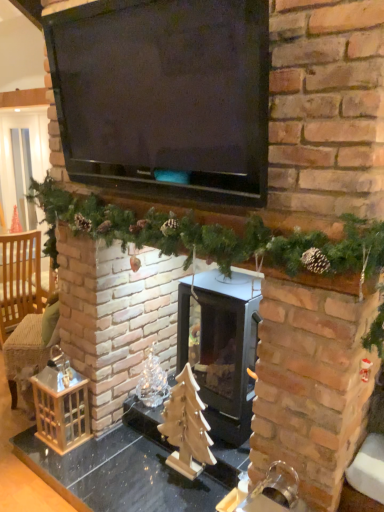
Locate an element on the screen. The height and width of the screenshot is (512, 384). wooden table at center is located at coordinates (131, 468).

Describe the element at coordinates (221, 347) in the screenshot. I see `black glass wood burning stove at center` at that location.

Locate an element on the screen. The image size is (384, 512). wooden christmas tree at center is located at coordinates (186, 426).

This screenshot has height=512, width=384. Describe the element at coordinates (164, 95) in the screenshot. I see `black matte television at upper center` at that location.

I want to click on green garland at center, so click(212, 236).

Is green garland at center facing away from wooden table at center?

green garland at center does not have its back to wooden table at center.

In terms of height, does green garland at center look taller or shorter compared to wooden table at center?

In the image, green garland at center appears to be shorter than wooden table at center.

Considering the sizes of objects green garland at center and wooden table at center in the image provided, who is bigger, green garland at center or wooden table at center?

wooden table at center.

What's the angular difference between green garland at center and wooden table at center's facing directions?

The angle between the facing direction of green garland at center and the facing direction of wooden table at center is 0.00455 degrees.

From a real-world perspective, which object stands above the other?

green garland at center, from a real-world perspective.

Consider the image. Is light brown woven armchair at left wider or thinner than green garland at center?

In the image, light brown woven armchair at left appears to be wider than green garland at center.

Based on the photo, considering the sizes of objects light brown woven armchair at left and green garland at center in the image provided, who is smaller, light brown woven armchair at left or green garland at center?

Smaller between the two is green garland at center.

Consider the image. Does light brown woven armchair at left have a smaller size compared to wooden christmas tree at center?

No, light brown woven armchair at left is not smaller than wooden christmas tree at center.

From the image's perspective, between light brown woven armchair at left and wooden christmas tree at center, who is located below?

wooden christmas tree at center is shown below in the image.

Is light brown woven armchair at left next to wooden christmas tree at center?

No, light brown woven armchair at left is not touching wooden christmas tree at center.

Is point (11, 314) closer or farther from the camera than point (176, 386)?

Clearly, point (11, 314) is more distant from the camera than point (176, 386).

Looking at their sizes, would you say green garland at center is wider or thinner than light brown woven armchair at left?

In the image, green garland at center appears to be more narrow than light brown woven armchair at left.

Is green garland at center in front of or behind light brown woven armchair at left in the image?

green garland at center is positioned closer to the viewer than light brown woven armchair at left.

From a real-world perspective, who is located lower, green garland at center or light brown woven armchair at left?

In real-world perspective, light brown woven armchair at left is lower.

Which is in front, point (138, 453) or point (4, 278)?

Positioned in front is point (138, 453).

Is wooden table at center positioned behind light brown woven armchair at left?

No, wooden table at center is closer to the camera.

At what (x,y) coordinates should I click in order to perform the action: click on table in front of the light brown woven armchair at left. Please return your answer as a coordinate pair (x, y). Looking at the image, I should click on (131, 468).

Consider the image. Considering the relative sizes of wooden table at center and light brown woven armchair at left in the image provided, is wooden table at center thinner than light brown woven armchair at left?

Yes, wooden table at center is thinner than light brown woven armchair at left.

How different are the orientations of green garland at center and black glass wood burning stove at center in degrees?

green garland at center and black glass wood burning stove at center are facing 0.00494 degrees away from each other.

Looking at the image, does green garland at center seem bigger or smaller compared to black glass wood burning stove at center?

In the image, green garland at center appears to be smaller than black glass wood burning stove at center.

From the image's perspective, is green garland at center above black glass wood burning stove at center?

Indeed, from the image's perspective, green garland at center is shown above black glass wood burning stove at center.

Does green garland at center have a lesser height compared to black glass wood burning stove at center?

Correct, green garland at center is not as tall as black glass wood burning stove at center.

Considering the relative sizes of wooden table at center and green garland at center in the image provided, is wooden table at center taller than green garland at center?

Correct, wooden table at center is much taller as green garland at center.

Is green garland at center inside wooden table at center?

That's incorrect, green garland at center is not inside wooden table at center.

Can you tell me how much wooden table at center and green garland at center differ in facing direction?

0.00455 degrees.

Which is closer to the camera, [218,450] or [51,211]?

Positioned in front is point [218,450].

What are the coordinates of `table located underneath the green garland at center (from a real-world perspective)` in the screenshot? It's located at (131, 468).

Identify the location of armchair behind the green garland at center. (20, 280).

Which object lies further to the anchor point black matte television at upper center, light brown woven armchair at left or black glass wood burning stove at center?

light brown woven armchair at left is positioned further to the anchor black matte television at upper center.

Estimate the real-world distances between objects in this image. Which object is further from green garland at center, wooden christmas tree at center or black matte television at upper center?

wooden christmas tree at center is further to green garland at center.

Looking at the image, which one is located closer to light brown woven armchair at left, wooden table at center or wooden christmas tree at center?

Among the two, wooden table at center is located nearer to light brown woven armchair at left.

From the picture: Looking at the image, which one is located closer to wooden christmas tree at center, light brown woven armchair at left or wooden table at center?

wooden table at center is closer to wooden christmas tree at center.

In the scene shown: Which object lies further to the anchor point light brown woven armchair at left, black matte television at upper center or wooden christmas tree at center?

black matte television at upper center lies further to light brown woven armchair at left than the other object.

From the image, which object appears to be nearer to wooden christmas tree at center, black matte television at upper center or green garland at center?

Based on the image, green garland at center appears to be nearer to wooden christmas tree at center.

Looking at the image, which one is located closer to wooden christmas tree at center, wooden table at center or black matte television at upper center?

wooden table at center.

Estimate the real-world distances between objects in this image. Which object is closer to black glass wood burning stove at center, light brown woven armchair at left or black matte television at upper center?

black matte television at upper center lies closer to black glass wood burning stove at center than the other object.

Locate an element on the screen. The height and width of the screenshot is (512, 384). table situated between light brown woven armchair at left and black glass wood burning stove at center from left to right is located at coordinates (131, 468).

Identify the location of table located between black matte television at upper center and light brown woven armchair at left in the depth direction. The height and width of the screenshot is (512, 384). (131, 468).

In order to click on christmas tree between black matte television at upper center and wooden table at center vertically in this screenshot , I will do `click(186, 426)`.

Find the location of a particular element. The image size is (384, 512). wood burning stove between black matte television at upper center and wooden table at center in the vertical direction is located at coordinates 221,347.